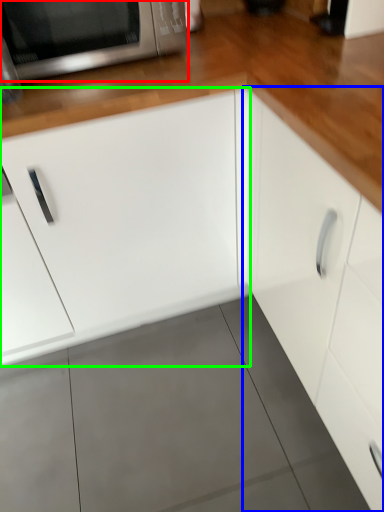
Question: Estimate the real-world distances between objects in this image. Which object is closer to microwave oven (highlighted by a red box), cabinetry (highlighted by a blue box) or cabinetry (highlighted by a green box)?

Choices:
 (A) cabinetry
 (B) cabinetry

Answer: (B)